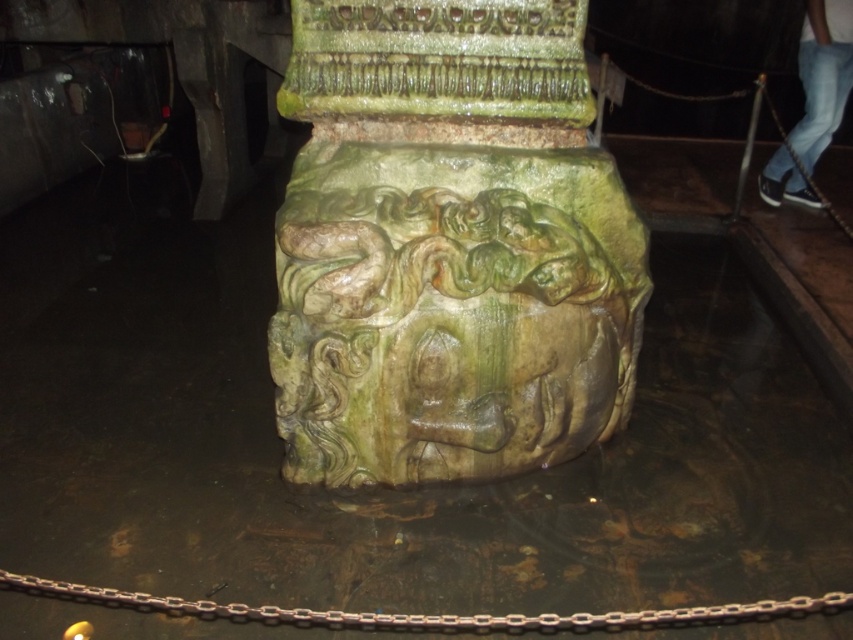
Question: Which point is closer to the camera?

Choices:
 (A) (787, 176)
 (B) (355, 362)

Answer: (B)

Question: Estimate the real-world distances between objects in this image. Which object is closer to the rusty metal chain at lower center?

Choices:
 (A) jeans at lower right
 (B) green marble statue at center

Answer: (B)

Question: Does rusty metal chain at lower center lie behind jeans at lower right?

Choices:
 (A) yes
 (B) no

Answer: (B)

Question: Can you confirm if green marble statue at center is bigger than rusty metal chain at lower center?

Choices:
 (A) yes
 (B) no

Answer: (A)

Question: Does green marble statue at center have a smaller size compared to rusty metal chain at lower center?

Choices:
 (A) no
 (B) yes

Answer: (A)

Question: Which object is the farthest from the jeans at lower right?

Choices:
 (A) green marble statue at center
 (B) rusty metal chain at lower center

Answer: (B)